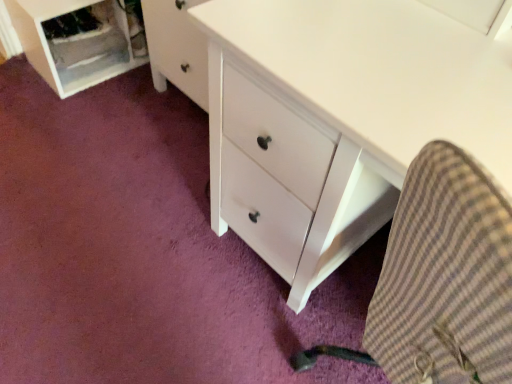
In order to click on brown checkered fabric at lower right in this screenshot , I will do `click(441, 280)`.

What is the approximate width of brown checkered fabric at lower right?

19.43 inches.

The height and width of the screenshot is (384, 512). What do you see at coordinates (441, 280) in the screenshot?
I see `brown checkered fabric at lower right` at bounding box center [441, 280].

At what (x,y) coordinates should I click in order to perform the action: click on white plastic file cabinet at lower left. Please return your answer as a coordinate pair (x, y). Looking at the image, I should click on (74, 44).

Measure the distance between white plastic file cabinet at lower left and camera.

1.47 meters.

This screenshot has height=384, width=512. What do you see at coordinates (74, 44) in the screenshot? I see `white plastic file cabinet at lower left` at bounding box center [74, 44].

Find the location of a particular element. The image size is (512, 384). brown checkered fabric at lower right is located at coordinates (441, 280).

Considering the relative positions of brown checkered fabric at lower right and white plastic file cabinet at lower left in the image provided, is brown checkered fabric at lower right to the left or to the right of white plastic file cabinet at lower left?

brown checkered fabric at lower right is positioned on white plastic file cabinet at lower left's right side.

Considering their positions, is brown checkered fabric at lower right located in front of or behind white plastic file cabinet at lower left?

In the image, brown checkered fabric at lower right appears in front of white plastic file cabinet at lower left.

Which point is more distant from viewer, (x=439, y=226) or (x=110, y=59)?

Positioned behind is point (x=110, y=59).

From the image's perspective, which one is positioned lower, brown checkered fabric at lower right or white plastic file cabinet at lower left?

brown checkered fabric at lower right is shown below in the image.

From a real-world perspective, which object stands above the other?

In real-world perspective, brown checkered fabric at lower right is above.

Is brown checkered fabric at lower right wider than white plastic file cabinet at lower left?

Correct, the width of brown checkered fabric at lower right exceeds that of white plastic file cabinet at lower left.

Considering the sizes of objects brown checkered fabric at lower right and white plastic file cabinet at lower left in the image provided, who is taller, brown checkered fabric at lower right or white plastic file cabinet at lower left?

brown checkered fabric at lower right is taller.

Considering the sizes of objects brown checkered fabric at lower right and white plastic file cabinet at lower left in the image provided, who is bigger, brown checkered fabric at lower right or white plastic file cabinet at lower left?

Bigger between the two is brown checkered fabric at lower right.

Does brown checkered fabric at lower right contain white plastic file cabinet at lower left?

Definitely not — white plastic file cabinet at lower left is not inside brown checkered fabric at lower right.

Based on the photo, is brown checkered fabric at lower right positioned far away from white plastic file cabinet at lower left?

Yes, brown checkered fabric at lower right is far from white plastic file cabinet at lower left.

Is brown checkered fabric at lower right aimed at white plastic file cabinet at lower left?

No.

How different are the orientations of brown checkered fabric at lower right and white plastic file cabinet at lower left in degrees?

The angular difference between brown checkered fabric at lower right and white plastic file cabinet at lower left is 66.5 degrees.

How much distance is there between brown checkered fabric at lower right and white plastic file cabinet at lower left?

A distance of 4.99 feet exists between brown checkered fabric at lower right and white plastic file cabinet at lower left.

Find the location of `file cabinet behind the brown checkered fabric at lower right`. file cabinet behind the brown checkered fabric at lower right is located at coordinates (74, 44).

Considering the positions of objects white plastic file cabinet at lower left and brown checkered fabric at lower right in the image provided, who is more to the right, white plastic file cabinet at lower left or brown checkered fabric at lower right?

Positioned to the right is brown checkered fabric at lower right.

Considering their positions, is white plastic file cabinet at lower left located in front of or behind brown checkered fabric at lower right?

In the image, white plastic file cabinet at lower left appears behind brown checkered fabric at lower right.

Does point (53, 84) come closer to viewer compared to point (385, 295)?

No, it is behind (385, 295).

From the image's perspective, does white plastic file cabinet at lower left appear higher than brown checkered fabric at lower right?

Yes, from the image's perspective, white plastic file cabinet at lower left is on top of brown checkered fabric at lower right.

Looking at this image, from a real-world perspective, which object stands above the other?

brown checkered fabric at lower right is physically above.

Does white plastic file cabinet at lower left have a lesser width compared to brown checkered fabric at lower right?

Indeed, white plastic file cabinet at lower left has a lesser width compared to brown checkered fabric at lower right.

Who is taller, white plastic file cabinet at lower left or brown checkered fabric at lower right?

With more height is brown checkered fabric at lower right.

Between white plastic file cabinet at lower left and brown checkered fabric at lower right, which one has larger size?

With larger size is brown checkered fabric at lower right.

Would you say white plastic file cabinet at lower left is inside or outside brown checkered fabric at lower right?

white plastic file cabinet at lower left is not enclosed by brown checkered fabric at lower right.

Is the surface of white plastic file cabinet at lower left in direct contact with brown checkered fabric at lower right?

No, white plastic file cabinet at lower left is not touching brown checkered fabric at lower right.

Is white plastic file cabinet at lower left oriented away from brown checkered fabric at lower right?

That's not correct — white plastic file cabinet at lower left is not looking away from brown checkered fabric at lower right.

How distant is white plastic file cabinet at lower left from brown checkered fabric at lower right?

white plastic file cabinet at lower left and brown checkered fabric at lower right are 4.99 feet apart.

In the image, there is a brown checkered fabric at lower right. What are the coordinates of `file cabinet below it (from a real-world perspective)` in the screenshot? It's located at (74, 44).

Where is `file cabinet behind the brown checkered fabric at lower right`? The width and height of the screenshot is (512, 384). file cabinet behind the brown checkered fabric at lower right is located at coordinates (74, 44).

Identify the location of computer chair lying on the right of white plastic file cabinet at lower left. (441, 280).